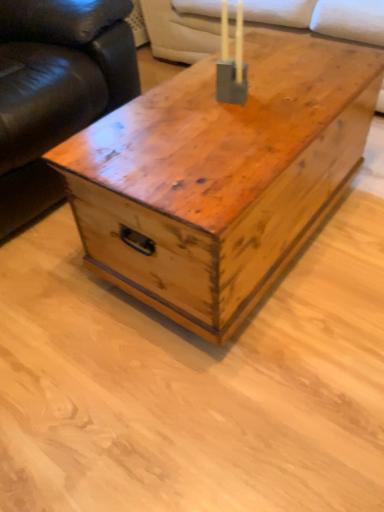
Question: Is suede-like beige couch at upper center bigger or smaller than wooden trunk at center?

Choices:
 (A) small
 (B) big

Answer: (B)

Question: Does point (281, 3) appear closer or farther from the camera than point (208, 106)?

Choices:
 (A) farther
 (B) closer

Answer: (A)

Question: Estimate the real-world distances between objects in this image. Which object is closer to the matte gray concrete candle holder at center?

Choices:
 (A) wooden trunk at center
 (B) suede-like beige couch at upper center
 (C) leather couch at left

Answer: (A)

Question: Which object is the closest to the leather couch at left?

Choices:
 (A) suede-like beige couch at upper center
 (B) wooden trunk at center
 (C) matte gray concrete candle holder at center

Answer: (B)